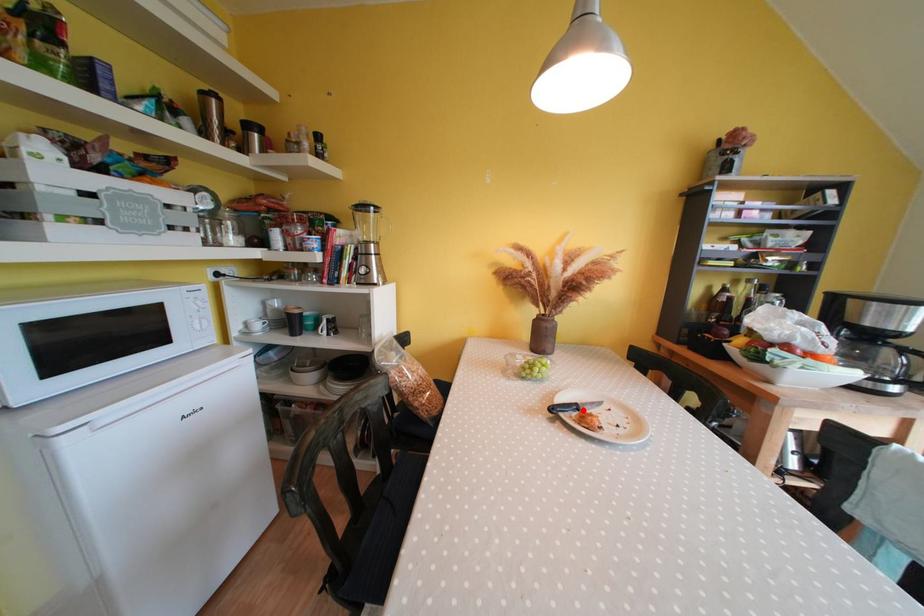
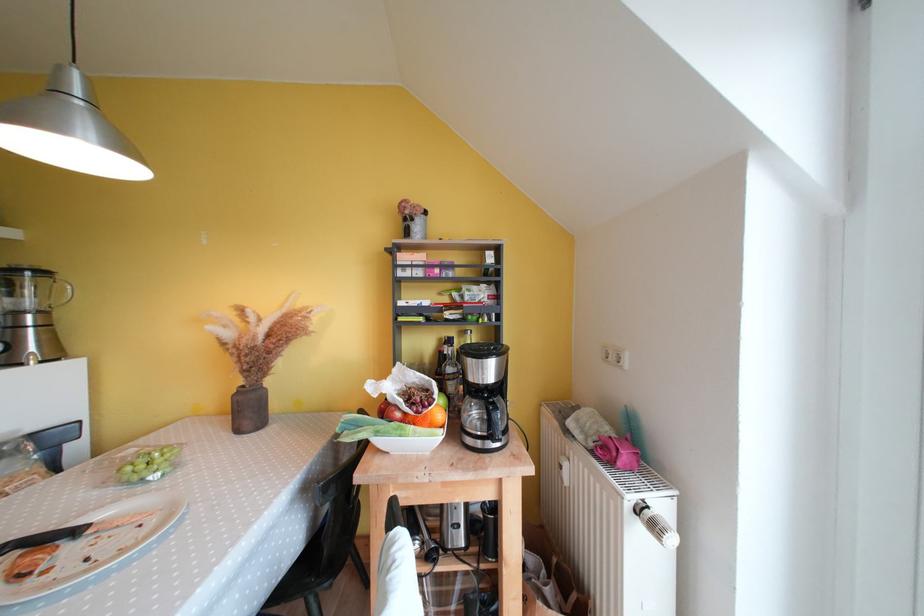
Where in the second image is the point corresponding to the highlighted location from the first image?

(83, 535)